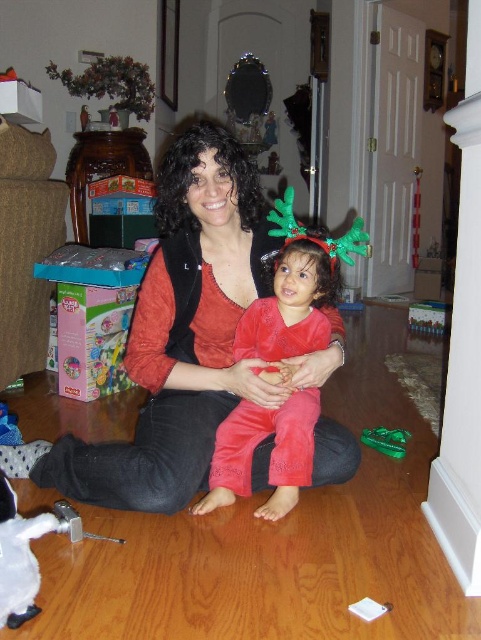
Question: Among these points, which one is nearest to the camera?

Choices:
 (A) (395, 435)
 (B) (206, 417)

Answer: (B)

Question: Which point appears closest to the camera in this image?

Choices:
 (A) (268, 298)
 (B) (377, 426)
 (C) (176, 504)

Answer: (C)

Question: Does matte black vest at center have a larger size compared to velvet red pants at center?

Choices:
 (A) no
 (B) yes

Answer: (B)

Question: Can you confirm if velvet red pants at center is thinner than green plastic toy at lower right?

Choices:
 (A) no
 (B) yes

Answer: (A)

Question: Can you confirm if matte black vest at center is positioned above velvet red pants at center?

Choices:
 (A) yes
 (B) no

Answer: (A)

Question: Which is nearer to the green plastic toy at lower right?

Choices:
 (A) matte black vest at center
 (B) velvet red pants at center

Answer: (B)